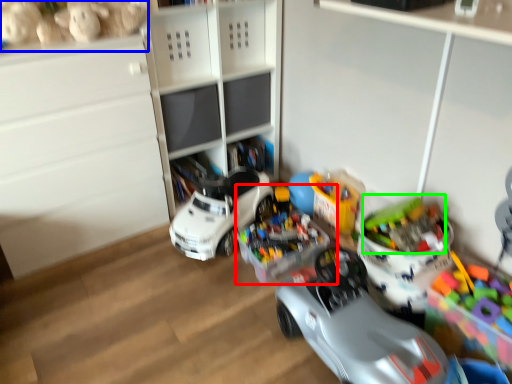
Question: Which is nearer to the toy (highlighted by a red box)? toy (highlighted by a blue box) or toy (highlighted by a green box).

Choices:
 (A) toy
 (B) toy

Answer: (B)